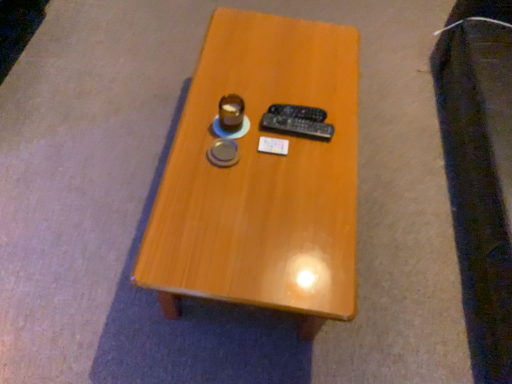
This screenshot has height=384, width=512. I want to click on vacant space in front of matte brown coffee cup at center, so click(x=220, y=175).